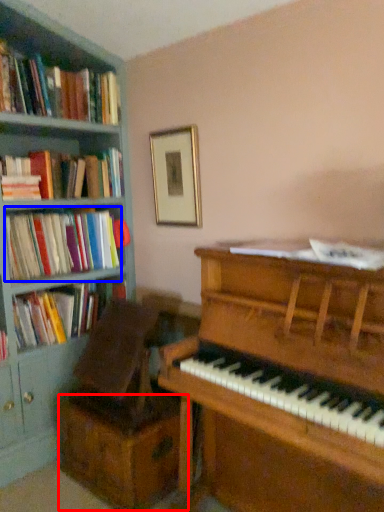
Question: Which object appears farthest to the camera in this image, drawer (highlighted by a red box) or book (highlighted by a blue box)?

Choices:
 (A) drawer
 (B) book

Answer: (B)